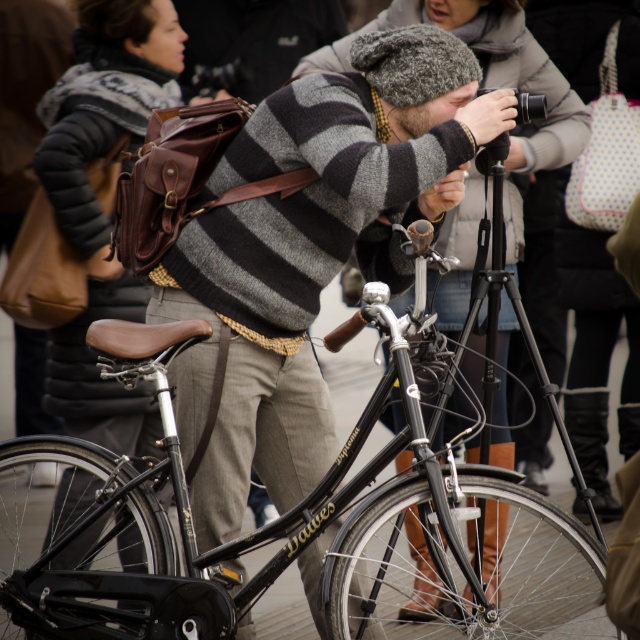
Which is behind, point (120, 470) or point (273, 388)?

The point (273, 388) is behind.

Is point (134, 620) positioned behind point (422, 61)?

No.

At what (x,y) coordinates should I click in order to perform the action: click on shiny black bicycle at center. Please return your answer as a coordinate pair (x, y). The height and width of the screenshot is (640, 640). Looking at the image, I should click on [x=280, y=524].

Is point (209, 284) positioned in front of point (472, 221)?

Yes, point (209, 284) is closer to viewer.

Does matte gray sweater at center have a greater width compared to striped wool sweater at center?

Indeed, matte gray sweater at center has a greater width compared to striped wool sweater at center.

Is point (259, 388) closer to viewer compared to point (531, 138)?

Yes, point (259, 388) is closer to viewer.

I want to click on matte gray sweater at center, so click(x=316, y=244).

Is shiny black bicycle at center shorter than striped wool sweater at center?

Yes, shiny black bicycle at center is shorter than striped wool sweater at center.

Who is taller, shiny black bicycle at center or striped wool sweater at center?

A: striped wool sweater at center is taller.

Locate an element on the screen. shiny black bicycle at center is located at coordinates (280, 524).